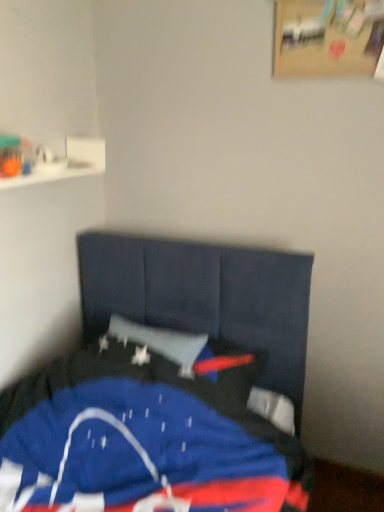
Question: Should I look upward or downward to see blue fabric bed at lower left?

Choices:
 (A) down
 (B) up

Answer: (A)